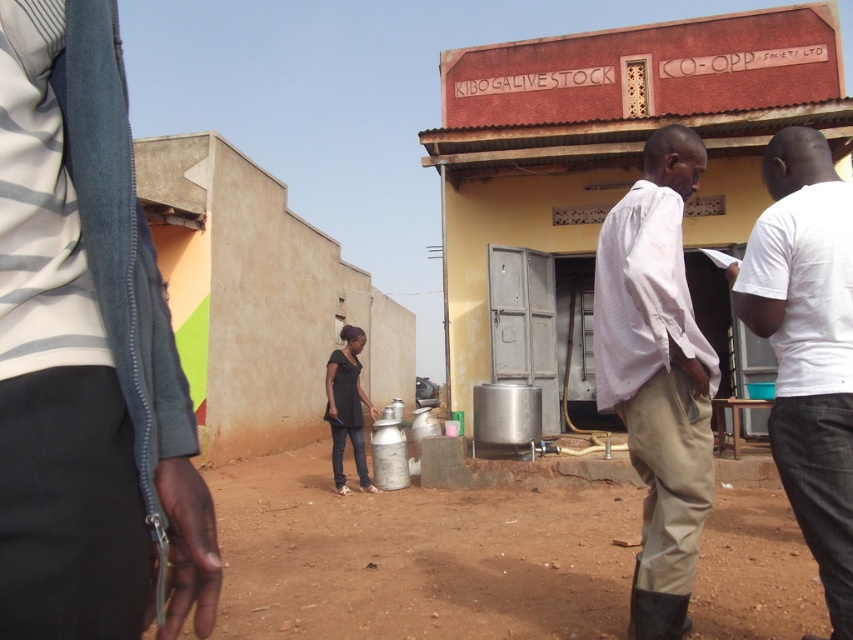
Which of these two, metallic silver tank at center or white cotton shirt at center, stands taller?

With more height is metallic silver tank at center.

Is point (532, 376) less distant than point (664, 410)?

No, it is behind (664, 410).

The width and height of the screenshot is (853, 640). Find the location of `metallic silver tank at center`. metallic silver tank at center is located at coordinates (601, 168).

Does point (363, 381) come in front of point (828, 177)?

No.

Consider the image. Does beige concrete wall at center appear on the left side of white cotton shirt at right?

Yes, beige concrete wall at center is to the left of white cotton shirt at right.

Locate an element on the screen. This screenshot has height=640, width=853. beige concrete wall at center is located at coordinates (258, 298).

The image size is (853, 640). Find the location of `beige concrete wall at center`. beige concrete wall at center is located at coordinates (258, 298).

Can you confirm if beige concrete wall at center is bigger than white cotton shirt at center?

Correct, beige concrete wall at center is larger in size than white cotton shirt at center.

This screenshot has width=853, height=640. What are the coordinates of `beige concrete wall at center` in the screenshot? It's located at (258, 298).